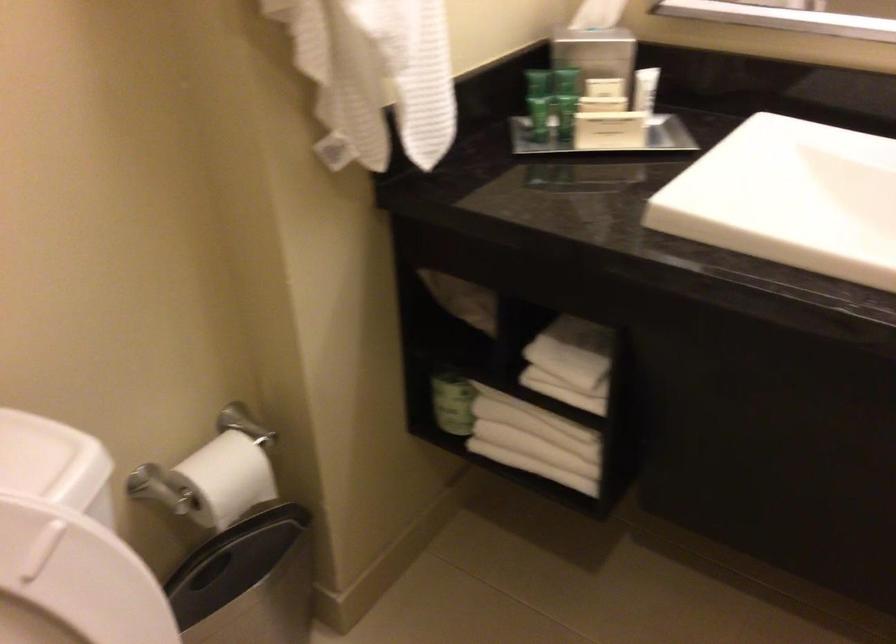
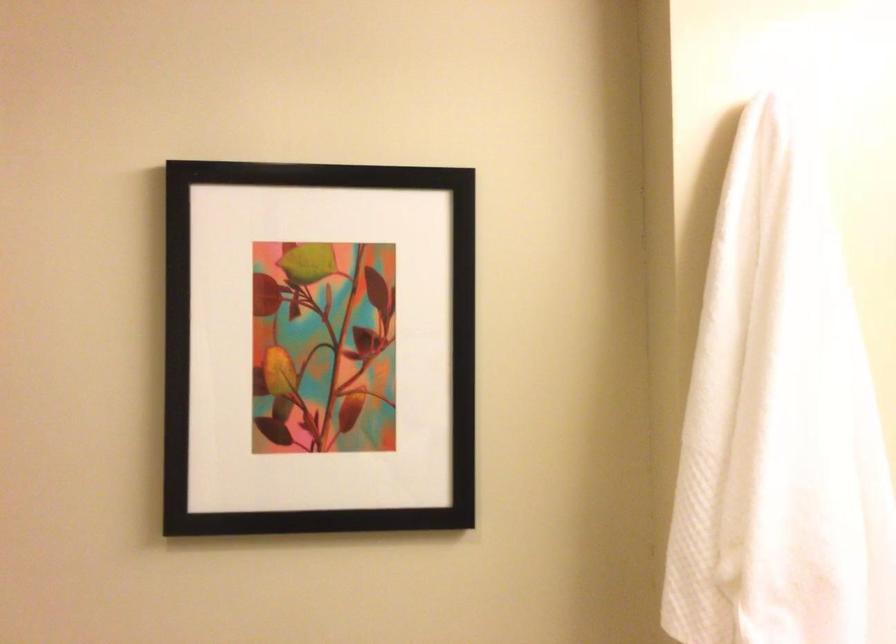
First-person continuous shooting, in which direction is the camera rotating?

The camera rotated toward left-up.